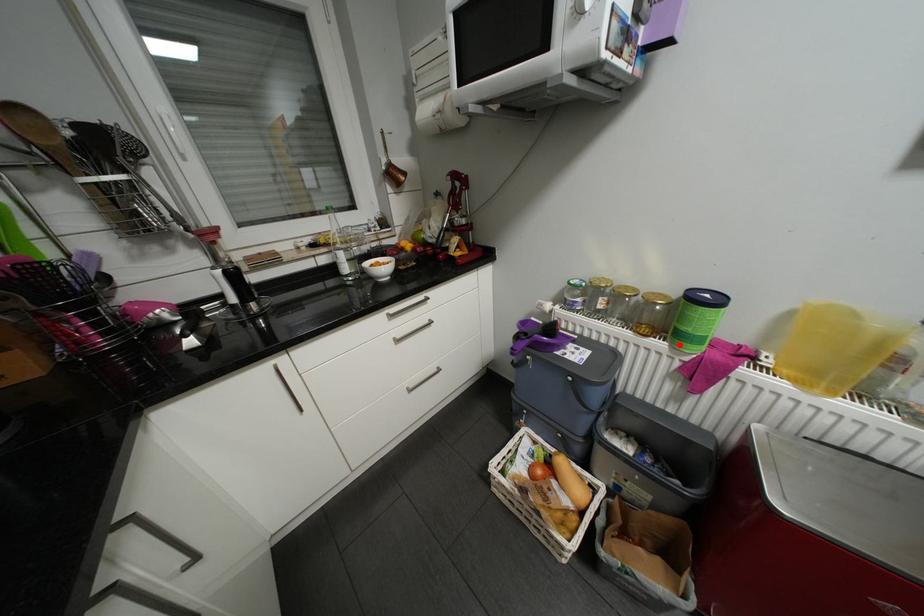
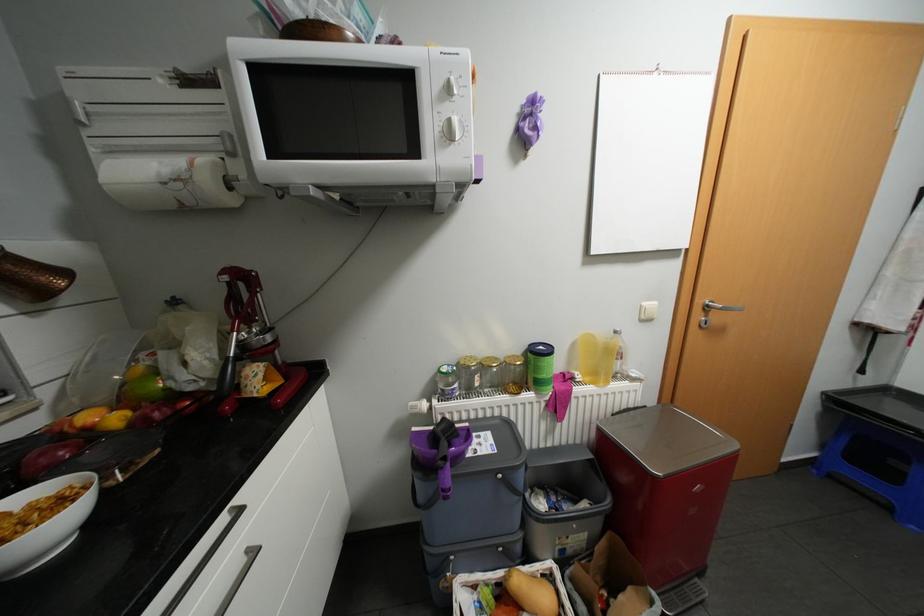
Locate, in the second image, the point that corresponds to the highlighted location in the first image.

(544, 392)